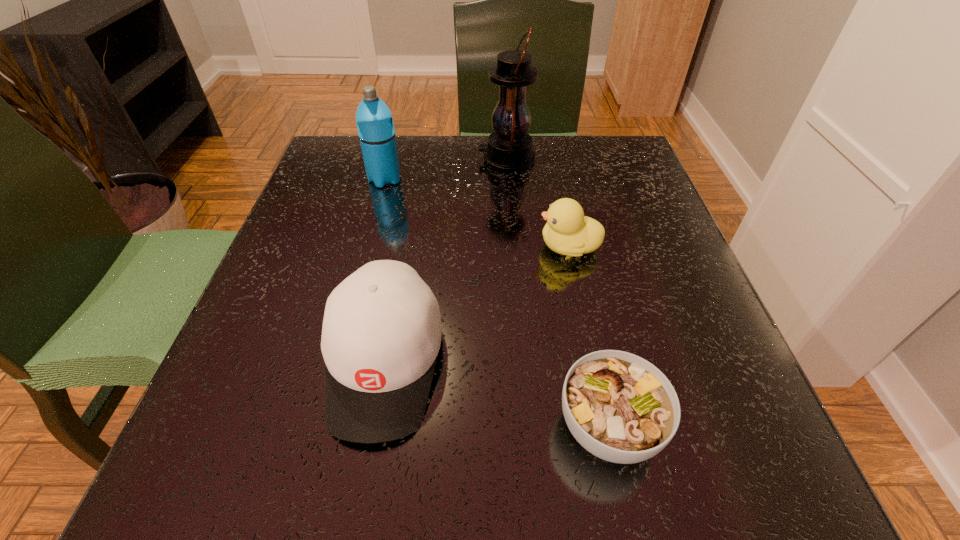
Where is `the tallest object`? This screenshot has width=960, height=540. the tallest object is located at coordinates (509, 149).

Locate an element on the screen. This screenshot has width=960, height=540. thermos bottle is located at coordinates (374, 120).

Where is `the third tallest object`? The height and width of the screenshot is (540, 960). the third tallest object is located at coordinates (x=381, y=334).

You are a GUI agent. You are given a task and a screenshot of the screen. Output one action in this format:
    pyautogui.click(x=<x>, y=<y>)
    Task: Click on the third nearest object
    This screenshot has width=960, height=540.
    Given the screenshot: What is the action you would take?
    pyautogui.click(x=568, y=232)

Locate an element on the screen. The width and height of the screenshot is (960, 540). duckling is located at coordinates (568, 232).

Identify the location of the shortest object. (621, 408).

What is the location of a free spot located above the lantern, indicating its light source? Please provide its 2D coordinates. Your answer should be formatted as a tuple, i.e. [(x, y)], where the tuple contains the x and y coordinates of a point satisfying the conditions above.

[(320, 159)]

Identify a few places in the vacant region located above the lantern, indicating its light source. Please provide its 2D coordinates. Your answer should be formatted as a tuple, i.e. [(x, y)], where the tuple contains the x and y coordinates of a point satisfying the conditions above.

[(354, 159)]

Identify some points within the free space located above the lantern, indicating its light source. Please provide its 2D coordinates. Your answer should be formatted as a tuple, i.e. [(x, y)], where the tuple contains the x and y coordinates of a point satisfying the conditions above.

[(320, 159)]

The width and height of the screenshot is (960, 540). I want to click on free space located on the back of the thermos bottle, so click(x=396, y=139).